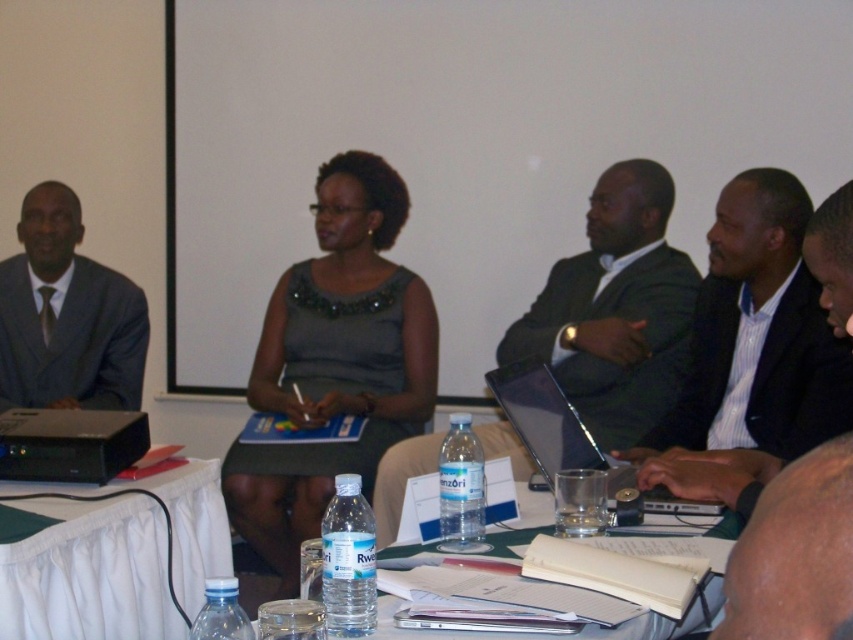
Question: Which point appears farthest from the camera in this image?

Choices:
 (A) (329, 484)
 (B) (397, 605)

Answer: (A)

Question: Does dark gray suit at center have a greater width compared to white fabric table at lower left?

Choices:
 (A) yes
 (B) no

Answer: (A)

Question: Does dark gray suit at center have a smaller size compared to silver metallic laptop at center?

Choices:
 (A) no
 (B) yes

Answer: (A)

Question: Can you confirm if white fabric table at lower left is wider than matte black suit at left?

Choices:
 (A) yes
 (B) no

Answer: (B)

Question: Which of the following is the closest to the observer?

Choices:
 (A) (796, 296)
 (B) (26, 328)
 (C) (831, 580)

Answer: (C)

Question: Which of these objects is positioned farthest from the green fabric table at center?

Choices:
 (A) smooth black laptop at center
 (B) silver metallic laptop at center

Answer: (A)